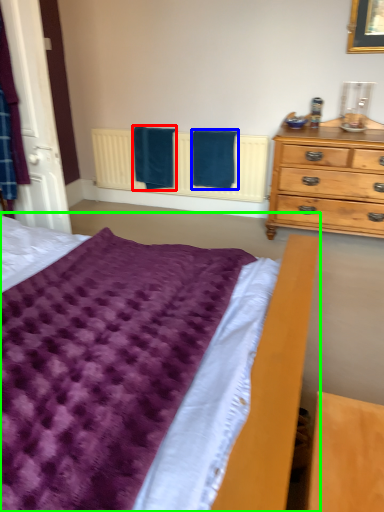
Question: Which object is the closest to the bath towel (highlighted by a red box)? Choose among these: bath towel (highlighted by a blue box) or bed (highlighted by a green box).

Choices:
 (A) bath towel
 (B) bed

Answer: (A)